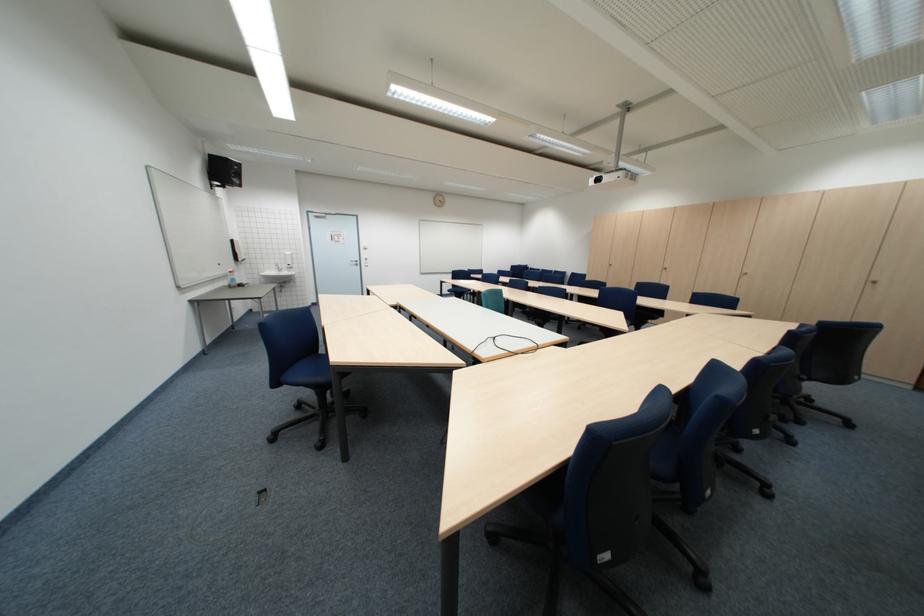
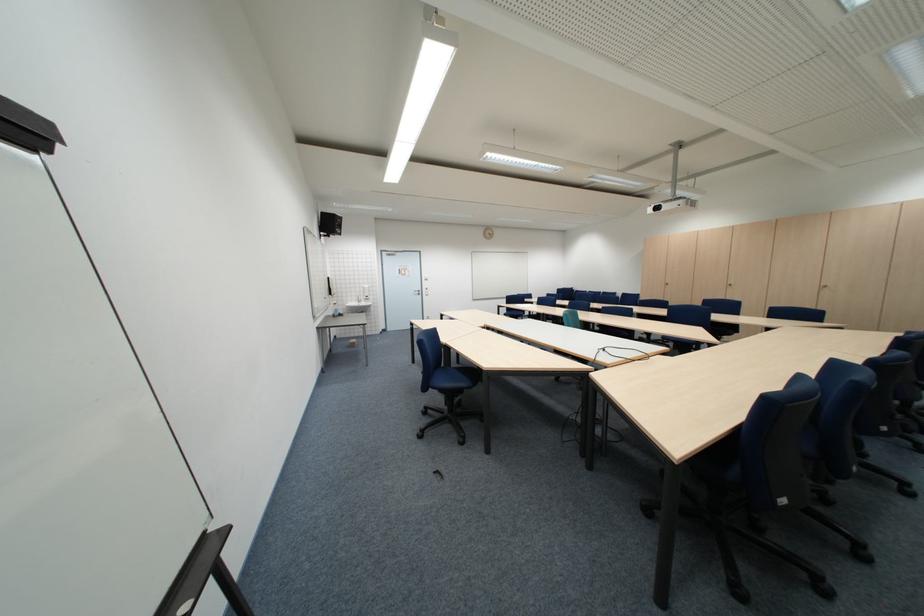
In the second image, find the point that corresponds to (x=289, y=383) in the first image.

(439, 389)